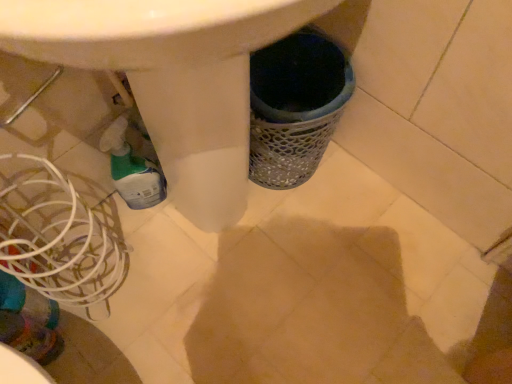
Question: Is white wire basket at lower left inside or outside of translucent plastic bottle at lower left?

Choices:
 (A) inside
 (B) outside

Answer: (B)

Question: Is white wire basket at lower left in front of or behind translucent plastic bottle at lower left in the image?

Choices:
 (A) front
 (B) behind

Answer: (A)

Question: Looking at the image, does white wire basket at lower left seem bigger or smaller compared to translucent plastic bottle at lower left?

Choices:
 (A) big
 (B) small

Answer: (A)

Question: In terms of width, does translucent plastic bottle at lower left look wider or thinner when compared to white wire basket at lower left?

Choices:
 (A) thin
 (B) wide

Answer: (A)

Question: Is point (108, 152) closer or farther from the camera than point (17, 157)?

Choices:
 (A) closer
 (B) farther

Answer: (B)

Question: Is translucent plastic bottle at lower left bigger or smaller than white wire basket at lower left?

Choices:
 (A) big
 (B) small

Answer: (B)

Question: Is translucent plastic bottle at lower left taller or shorter than white wire basket at lower left?

Choices:
 (A) tall
 (B) short

Answer: (B)